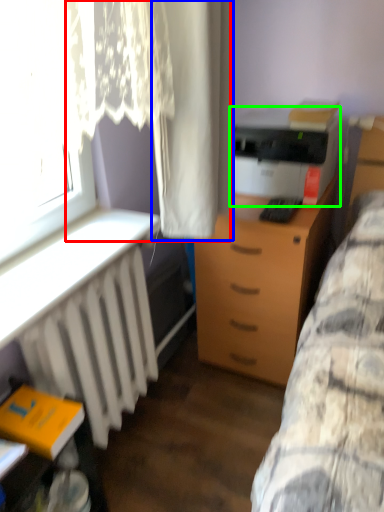
Question: Which is farther away from curtain (highlighted by a red box)? curtain (highlighted by a blue box) or printer (highlighted by a green box)?

Choices:
 (A) curtain
 (B) printer

Answer: (B)